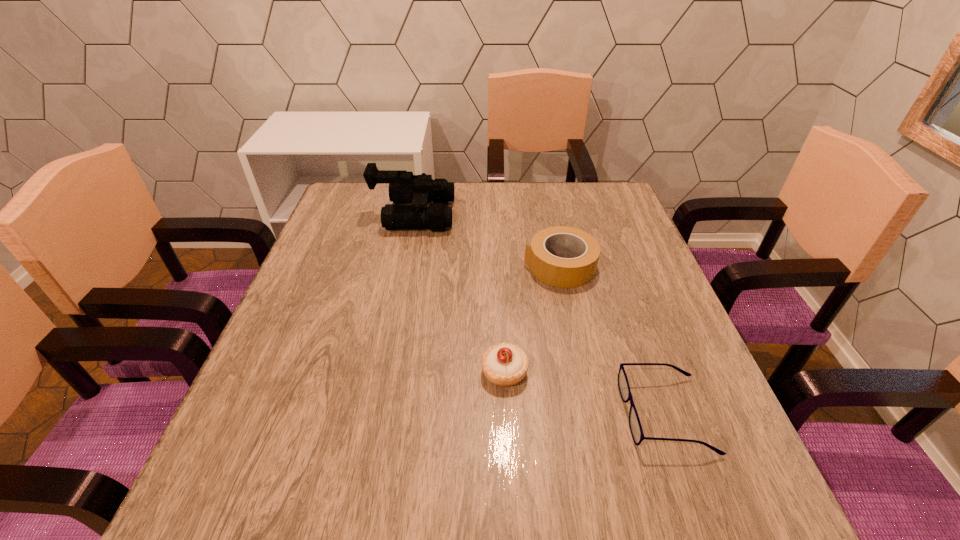
Locate an element on the screen. binoculars is located at coordinates (404, 187).

Where is `the farthest object`? The height and width of the screenshot is (540, 960). the farthest object is located at coordinates pos(404,187).

The height and width of the screenshot is (540, 960). I want to click on pastry, so click(x=504, y=364).

Locate an element on the screen. This screenshot has width=960, height=540. the third nearest object is located at coordinates (560, 272).

Find the location of a particular element. Image resolution: width=960 pixels, height=540 pixels. spectacles is located at coordinates (635, 426).

This screenshot has width=960, height=540. In order to click on vacant area situated 0.050m on the front lenses of the leftmost object in this screenshot , I will do `click(470, 214)`.

Find the location of `free location located on the back of the third object from right to left`. free location located on the back of the third object from right to left is located at coordinates (498, 247).

In order to click on free space located at the edge of the duct tape in this screenshot , I will do `click(448, 266)`.

Where is `free space located at the edge of the duct tape`? Image resolution: width=960 pixels, height=540 pixels. free space located at the edge of the duct tape is located at coordinates (369, 266).

Locate an element on the screen. The width and height of the screenshot is (960, 540). vacant space located 0.350m at the edge of the duct tape is located at coordinates (385, 266).